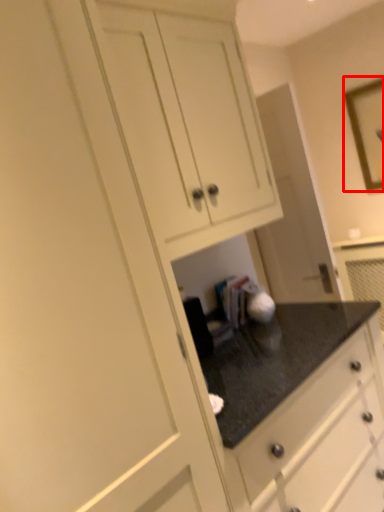
Question: From the image's perspective, where is picture frame (annotated by the red box) located relative to cabinetry?

Choices:
 (A) above
 (B) below

Answer: (A)